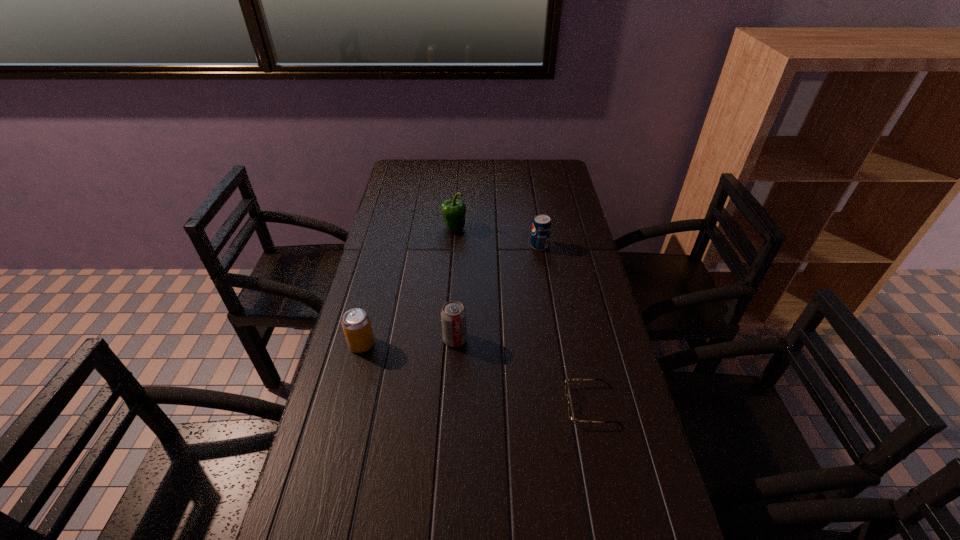
The width and height of the screenshot is (960, 540). I want to click on free spot at the far left corner of the desktop, so click(x=420, y=171).

Where is `vacant space at the far right corner`? The width and height of the screenshot is (960, 540). vacant space at the far right corner is located at coordinates (547, 161).

Find the location of a particular element. This screenshot has width=960, height=540. vacant region between the second farthest object and the spectacles is located at coordinates (565, 325).

Locate an element on the screen. free spot between the farthest object and the leftmost object is located at coordinates (408, 286).

At what (x,y) coordinates should I click in order to perform the action: click on vacant area that lies between the rightmost pop (soda) and the leftmost pop (soda). Please return your answer as a coordinate pair (x, y). The height and width of the screenshot is (540, 960). Looking at the image, I should click on (450, 295).

The height and width of the screenshot is (540, 960). What are the coordinates of `vacant space that's between the second pop (soda) from right to left and the farthest pop (soda)` in the screenshot? It's located at (497, 293).

In order to click on vacant space that is in between the second pop (soda) from left to right and the leftmost object in this screenshot , I will do `click(408, 342)`.

Find the location of `empty space between the second pop (soda) from left to right and the nearest object`. empty space between the second pop (soda) from left to right and the nearest object is located at coordinates (523, 372).

Where is `free space that is in between the second pop (soda) from left to right and the leftmost object`? free space that is in between the second pop (soda) from left to right and the leftmost object is located at coordinates [x=408, y=342].

At what (x,y) coordinates should I click in order to perform the action: click on vacant space that is in between the second pop (soda) from right to left and the bell pepper. Please return your answer as a coordinate pair (x, y). The image size is (960, 540). Looking at the image, I should click on (454, 284).